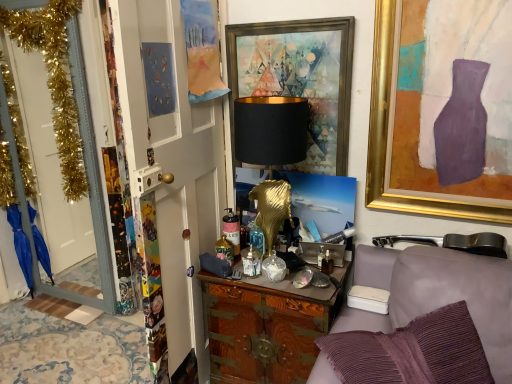
Where is `metallic gold picture frame at upper center, arranged as the second picture frame when viewed from the right`? metallic gold picture frame at upper center, arranged as the second picture frame when viewed from the right is located at coordinates (300, 79).

Locate an element on the screen. This screenshot has width=512, height=384. white fabric armchair at lower right is located at coordinates (438, 290).

The height and width of the screenshot is (384, 512). What do you see at coordinates (271, 151) in the screenshot? I see `black matte/golden base at center` at bounding box center [271, 151].

Describe the element at coordinates (88, 185) in the screenshot. I see `white glossy door at left, which is the 1th door in back-to-front order` at that location.

Where is `white painted wood door at left, the 2th door positioned from the left`? This screenshot has height=384, width=512. white painted wood door at left, the 2th door positioned from the left is located at coordinates (173, 166).

Does metallic gold picture frame at upper center, which appears as the 1th picture frame when viewed from the left, lie in front of white glossy door at left, marked as the 2th door in a right-to-left arrangement?

Yes, the depth of metallic gold picture frame at upper center, which appears as the 1th picture frame when viewed from the left, is less than that of white glossy door at left, marked as the 2th door in a right-to-left arrangement.

Between metallic gold picture frame at upper center, which appears as the 1th picture frame when viewed from the left, and white glossy door at left, marked as the 2th door in a right-to-left arrangement, which one has larger width?

Wider between the two is white glossy door at left, marked as the 2th door in a right-to-left arrangement.

Between point (312, 43) and point (94, 195), which one is positioned in front?

The point (312, 43) is closer.

From the picture: Considering the sizes of objects white painted wood door at left, which ranks as the 1th door in front-to-back order, and white glossy door at left, acting as the 1th door starting from the left, in the image provided, who is shorter, white painted wood door at left, which ranks as the 1th door in front-to-back order, or white glossy door at left, acting as the 1th door starting from the left,?

white painted wood door at left, which ranks as the 1th door in front-to-back order.

Which object is closer to the camera, white painted wood door at left, which is the first door in right-to-left order, or white glossy door at left, acting as the 1th door starting from the left?

Positioned in front is white painted wood door at left, which is the first door in right-to-left order.

Considering the positions of objects white painted wood door at left, which is the first door in right-to-left order, and white glossy door at left, acting as the 1th door starting from the left, in the image provided, who is more to the left, white painted wood door at left, which is the first door in right-to-left order, or white glossy door at left, acting as the 1th door starting from the left,?

white glossy door at left, acting as the 1th door starting from the left, is more to the left.

From a real-world perspective, who is located lower, white painted wood door at left, the 2th door positioned from the left, or white glossy door at left, acting as the 1th door starting from the left?

white painted wood door at left, the 2th door positioned from the left, is physically lower.

Does gold-framed painting at upper right, which is the 1th picture frame from right to left, touch black matte/golden base at center?

No, gold-framed painting at upper right, which is the 1th picture frame from right to left, is not touching black matte/golden base at center.

In terms of width, does gold-framed painting at upper right, which ranks as the second picture frame in left-to-right order, look wider or thinner when compared to black matte/golden base at center?

Considering their sizes, gold-framed painting at upper right, which ranks as the second picture frame in left-to-right order, looks slimmer than black matte/golden base at center.

What are the coordinates of `table lamp that appears below the gold-framed painting at upper right, which ranks as the second picture frame in left-to-right order (from a real-world perspective)` in the screenshot? It's located at (271, 151).

From the image's perspective, which is below, gold-framed painting at upper right, which is the 1th picture frame from right to left, or black matte/golden base at center?

black matte/golden base at center appears lower in the image.

Relative to metallic gold picture frame at upper center, arranged as the second picture frame when viewed from the right, is black matte/golden base at center in front or behind?

black matte/golden base at center is positioned closer to the viewer than metallic gold picture frame at upper center, arranged as the second picture frame when viewed from the right.

Which is more to the right, black matte/golden base at center or metallic gold picture frame at upper center, arranged as the second picture frame when viewed from the right?

metallic gold picture frame at upper center, arranged as the second picture frame when viewed from the right, is more to the right.

Considering the sizes of objects black matte/golden base at center and metallic gold picture frame at upper center, which appears as the 1th picture frame when viewed from the left, in the image provided, who is smaller, black matte/golden base at center or metallic gold picture frame at upper center, which appears as the 1th picture frame when viewed from the left,?

metallic gold picture frame at upper center, which appears as the 1th picture frame when viewed from the left.

Considering the sizes of objects white fabric armchair at lower right and black matte/golden base at center in the image provided, who is bigger, white fabric armchair at lower right or black matte/golden base at center?

With larger size is white fabric armchair at lower right.

Which of these two, white fabric armchair at lower right or black matte/golden base at center, stands shorter?

white fabric armchair at lower right is shorter.

You are a GUI agent. You are given a task and a screenshot of the screen. Output one action in this format:
    pyautogui.click(x=<x>, y=<y>)
    Task: Click on the table lamp on the left of white fabric armchair at lower right
    The height and width of the screenshot is (384, 512).
    Given the screenshot: What is the action you would take?
    pyautogui.click(x=271, y=151)

Is point (398, 308) farther from camera compared to point (255, 138)?

That is False.

Is wooden cabinet at center far from white fabric armchair at lower right?

No, there isn't a large distance between wooden cabinet at center and white fabric armchair at lower right.

From the picture: From a real-world perspective, which is physically above, wooden cabinet at center or white fabric armchair at lower right?

white fabric armchair at lower right.

Is wooden cabinet at center positioned with its back to white fabric armchair at lower right?

No, white fabric armchair at lower right is not at the back of wooden cabinet at center.

Which object is closer to the camera taking this photo, wooden cabinet at center or white fabric armchair at lower right?

white fabric armchair at lower right is in front.

Considering the positions of objects white glossy door at left, marked as the 2th door in a right-to-left arrangement, and white fabric armchair at lower right in the image provided, who is in front, white glossy door at left, marked as the 2th door in a right-to-left arrangement, or white fabric armchair at lower right?

white fabric armchair at lower right is more forward.

Are white glossy door at left, which is the 1th door in back-to-front order, and white fabric armchair at lower right making contact?

white glossy door at left, which is the 1th door in back-to-front order, and white fabric armchair at lower right are clearly separated.

Which is behind, point (23, 3) or point (484, 333)?

The point (23, 3) is behind.

Image resolution: width=512 pixels, height=384 pixels. Find the location of `door behind the metallic gold picture frame at upper center, which appears as the 1th picture frame when viewed from the left`. door behind the metallic gold picture frame at upper center, which appears as the 1th picture frame when viewed from the left is located at coordinates (88, 185).

The image size is (512, 384). Identify the location of door in front of the white glossy door at left, acting as the 1th door starting from the left. (173, 166).

Looking at the image, which one is located closer to wooden cabinet at center, white painted wood door at left, arranged as the second door when viewed from the back, or metallic gold picture frame at upper center, arranged as the second picture frame when viewed from the right?

The object closer to wooden cabinet at center is white painted wood door at left, arranged as the second door when viewed from the back.

When comparing their distances from metallic gold picture frame at upper center, arranged as the second picture frame when viewed from the right, does black matte/golden base at center or white glossy door at left, which is the 1th door in back-to-front order, seem closer?

Among the two, black matte/golden base at center is located nearer to metallic gold picture frame at upper center, arranged as the second picture frame when viewed from the right.

Estimate the real-world distances between objects in this image. Which object is further from wooden cabinet at center, white fabric armchair at lower right or white glossy door at left, which is the 1th door in back-to-front order?

white glossy door at left, which is the 1th door in back-to-front order, lies further to wooden cabinet at center than the other object.

From the picture: From the image, which object appears to be nearer to wooden cabinet at center, black matte/golden base at center or white fabric armchair at lower right?

white fabric armchair at lower right lies closer to wooden cabinet at center than the other object.

In the scene shown: Considering their positions, is white fabric armchair at lower right positioned closer to white glossy door at left, which is the 2th door from front to back, than black matte/golden base at center?

black matte/golden base at center is closer to white glossy door at left, which is the 2th door from front to back.

Which object lies further to the anchor point gold-framed painting at upper right, which is the 1th picture frame from right to left, white glossy door at left, which is the 2th door from front to back, or white painted wood door at left, which is the first door in right-to-left order?

white glossy door at left, which is the 2th door from front to back, is positioned further to the anchor gold-framed painting at upper right, which is the 1th picture frame from right to left.

Estimate the real-world distances between objects in this image. Which object is further from white fabric armchair at lower right, black matte/golden base at center or wooden cabinet at center?

black matte/golden base at center lies further to white fabric armchair at lower right than the other object.

Looking at this image, which object lies further to the anchor point wooden cabinet at center, black matte/golden base at center or metallic gold picture frame at upper center, arranged as the second picture frame when viewed from the right?

The object further to wooden cabinet at center is metallic gold picture frame at upper center, arranged as the second picture frame when viewed from the right.

The image size is (512, 384). In order to click on door between white glossy door at left, marked as the 2th door in a right-to-left arrangement, and black matte/golden base at center in this screenshot , I will do 173,166.

Identify the location of armchair between metallic gold picture frame at upper center, arranged as the second picture frame when viewed from the right, and wooden cabinet at center from top to bottom. (438, 290).

You are a GUI agent. You are given a task and a screenshot of the screen. Output one action in this format:
    pyautogui.click(x=<x>, y=<y>)
    Task: Click on the door between white glossy door at left, acting as the 1th door starting from the left, and gold-framed painting at upper right, which is the 1th picture frame from right to left, in the horizontal direction
    Image resolution: width=512 pixels, height=384 pixels.
    Given the screenshot: What is the action you would take?
    (x=173, y=166)

What are the coordinates of `picture frame between black matte/golden base at center and gold-framed painting at upper right, which is the 1th picture frame from right to left` in the screenshot? It's located at (300, 79).